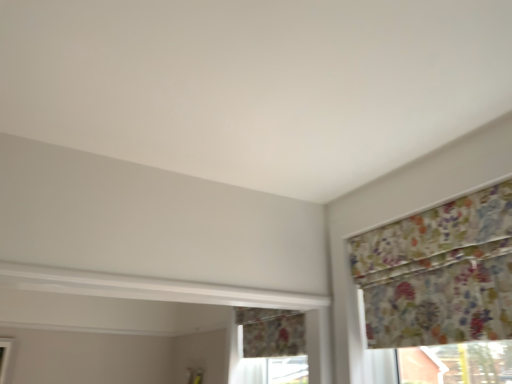
Question: Does floral fabric window at center turn towards floral fabric curtain at upper right?

Choices:
 (A) no
 (B) yes

Answer: (A)

Question: Does floral fabric window at center appear on the left side of floral fabric curtain at upper right?

Choices:
 (A) yes
 (B) no

Answer: (A)

Question: From the image's perspective, would you say floral fabric window at center is shown under floral fabric curtain at upper right?

Choices:
 (A) no
 (B) yes

Answer: (B)

Question: Is floral fabric window at center smaller than floral fabric curtain at upper right?

Choices:
 (A) yes
 (B) no

Answer: (B)

Question: Considering the relative positions of floral fabric window at center and floral fabric curtain at upper right in the image provided, is floral fabric window at center in front of floral fabric curtain at upper right?

Choices:
 (A) no
 (B) yes

Answer: (A)

Question: From a real-world perspective, does floral fabric window at center sit lower than floral fabric curtain at upper right?

Choices:
 (A) no
 (B) yes

Answer: (B)

Question: From a real-world perspective, is floral fabric curtain at upper right on top of floral fabric window at center?

Choices:
 (A) yes
 (B) no

Answer: (A)

Question: Considering the relative sizes of floral fabric curtain at upper right and floral fabric window at center in the image provided, is floral fabric curtain at upper right bigger than floral fabric window at center?

Choices:
 (A) no
 (B) yes

Answer: (A)

Question: Is the position of floral fabric curtain at upper right less distant than that of floral fabric window at center?

Choices:
 (A) yes
 (B) no

Answer: (A)

Question: Is floral fabric curtain at upper right smaller than floral fabric window at center?

Choices:
 (A) yes
 (B) no

Answer: (A)

Question: Is floral fabric curtain at upper right oriented away from floral fabric window at center?

Choices:
 (A) yes
 (B) no

Answer: (B)

Question: Is floral fabric curtain at upper right positioned beyond the bounds of floral fabric window at center?

Choices:
 (A) no
 (B) yes

Answer: (B)

Question: Considering the relative positions of floral fabric window at center and floral fabric curtain at upper right in the image provided, is floral fabric window at center to the left or to the right of floral fabric curtain at upper right?

Choices:
 (A) right
 (B) left

Answer: (B)